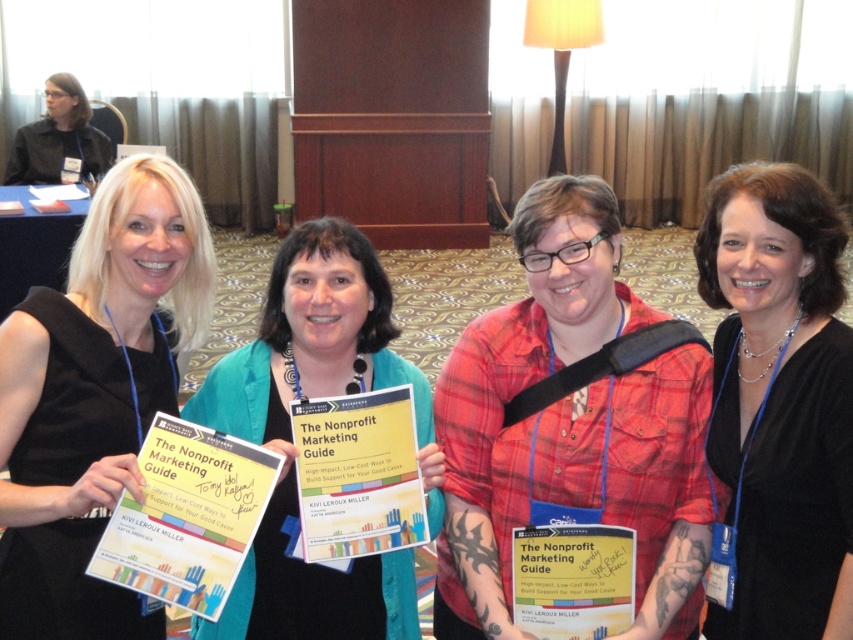
You are standing in the conference room and need to find the black fabric dress at left. According to the scene description, where should you look relative to the woman on the far left?

The black fabric dress at left is located at point (96, 397), which corresponds to the woman on the far left wearing it. Since she is standing on the far left side of the image, you should look towards the leftmost position among the group of women.

You are standing in the conference room and want to take a photo of the black fabric dress at left. Where should you position yourself to ensure the dress is in the frame?

To capture the black fabric dress at left in your photo, position yourself so that the dress is centered at coordinates approximately 0.622 on the x and 0.113 on the y axis.